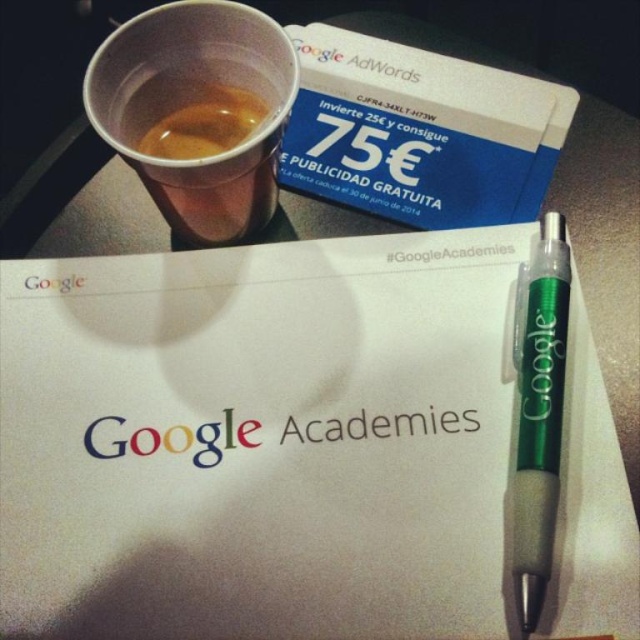
You are organizing a Google Academy event and need to place a 12cm wide name tag on the table. The name tag is larger than the translucent plastic cup at upper left. Can the white paper at center accommodate the name tag without overlapping other items?

The white paper at center is bigger than the translucent plastic cup at upper left. Since the name tag is larger than the cup, it might fit on the white paper at center, but you should check the exact size of the paper to ensure it can hold the name tag without overlapping other items.

Based on the scene description, where is the translucent plastic cup at upper left located in terms of coordinates?

The translucent plastic cup at upper left is located at point coordinates of (193, 100).